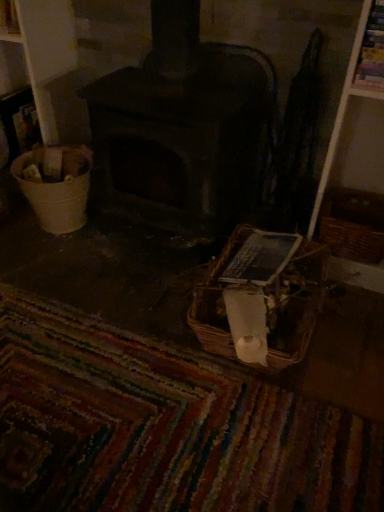
Where is `free spot to the right of woven brown basket at lower center, the first basket in the left-to-right sequence`? The height and width of the screenshot is (512, 384). free spot to the right of woven brown basket at lower center, the first basket in the left-to-right sequence is located at coordinates (350, 330).